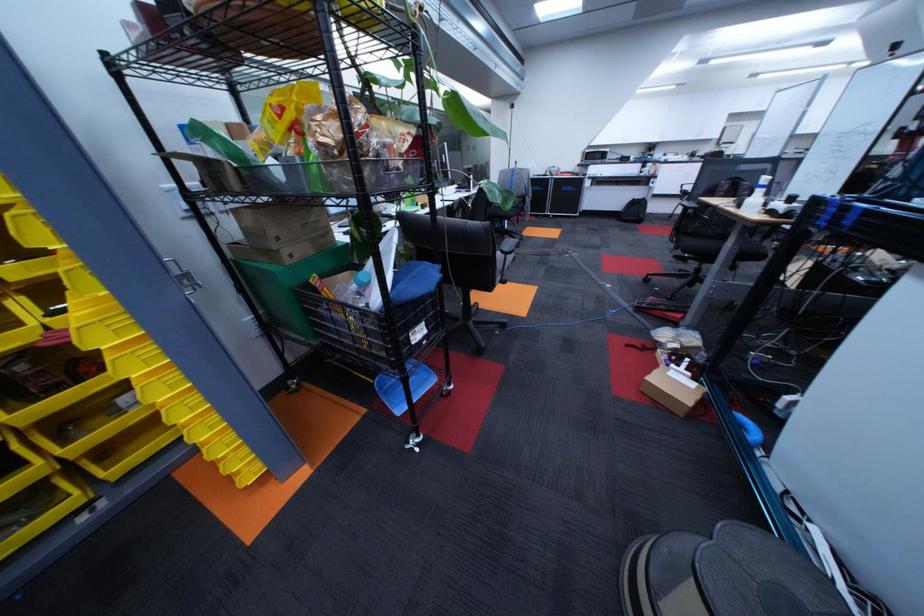
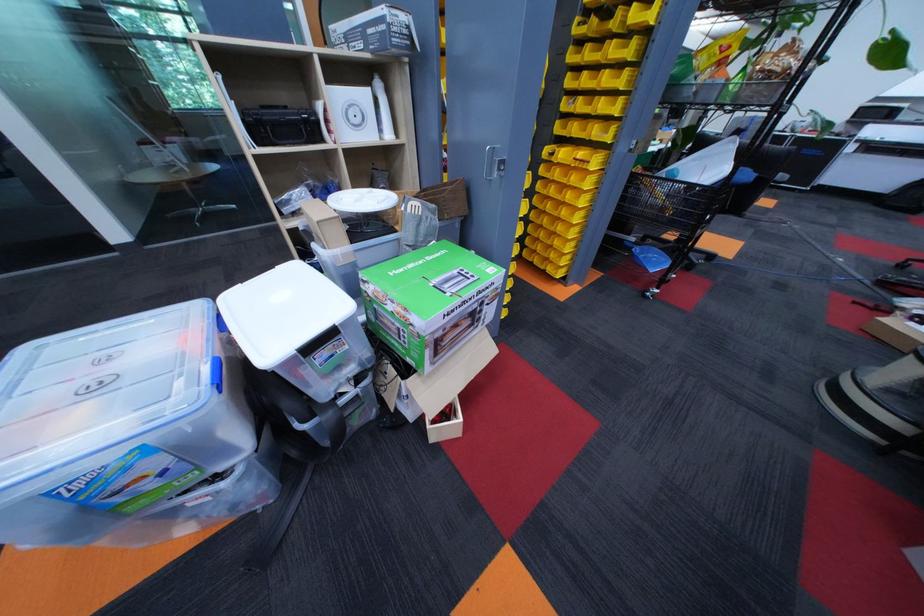
In a continuous first-person perspective shot, in which direction is the camera moving?

The movement direction of the cameraman is left, backward.